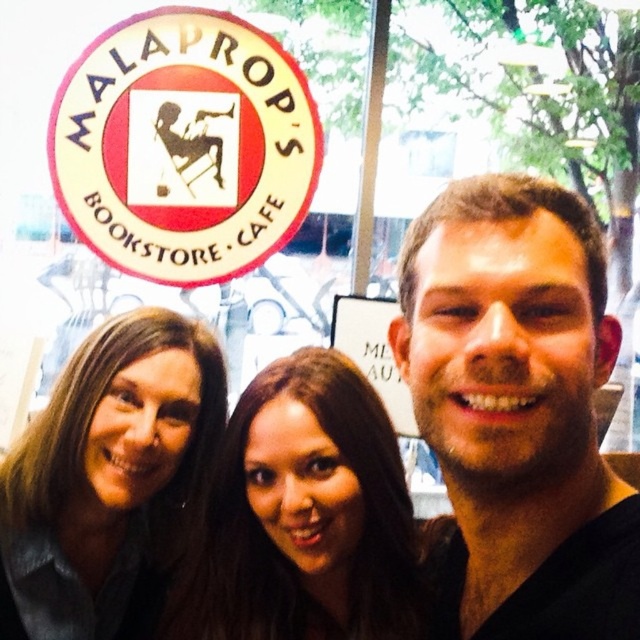
Question: Is brown hair at upper left above brown hair at center?

Choices:
 (A) yes
 (B) no

Answer: (A)

Question: Which point is closer to the camera?

Choices:
 (A) brown hair at upper left
 (B) black matte face at center
 (C) brown hair at center

Answer: (B)

Question: Which point is closer to the camera?

Choices:
 (A) brown hair at upper left
 (B) black matte face at center

Answer: (B)

Question: Among these points, which one is nearest to the camera?

Choices:
 (A) (563, 236)
 (B) (244, 429)

Answer: (A)

Question: Does brown hair at upper left have a greater width compared to brown hair at center?

Choices:
 (A) no
 (B) yes

Answer: (A)

Question: Is black matte face at center below brown hair at upper left?

Choices:
 (A) yes
 (B) no

Answer: (B)